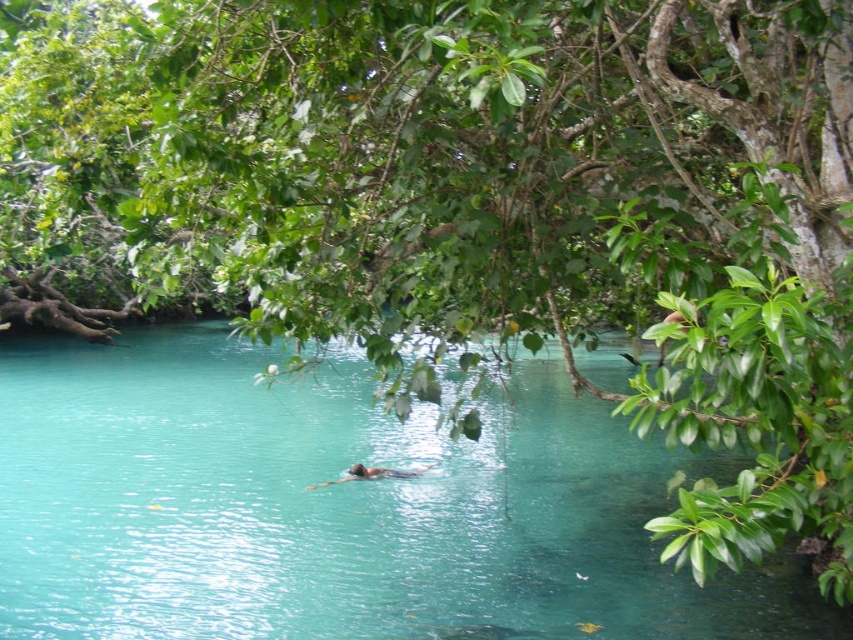
You are a photographer trying to capture the smooth skin person at center in the clear blue water at center. Based on the scene, will the person be fully visible in your photo?

The clear blue water at center is in front of the smooth skin person at center, so the person may be partially obscured by the water in the photo.

You are a photographer trying to capture the smooth skin person at center and the clear blue water at center in a single shot. Which object should you position closer to the left side of your camera frame?

The clear blue water at center is to the left of the smooth skin person at center, so to position the clear blue water at center closer to the left side of your camera frame, align the camera such that the clear blue water at center is on the left and the smooth skin person at center is on the right.